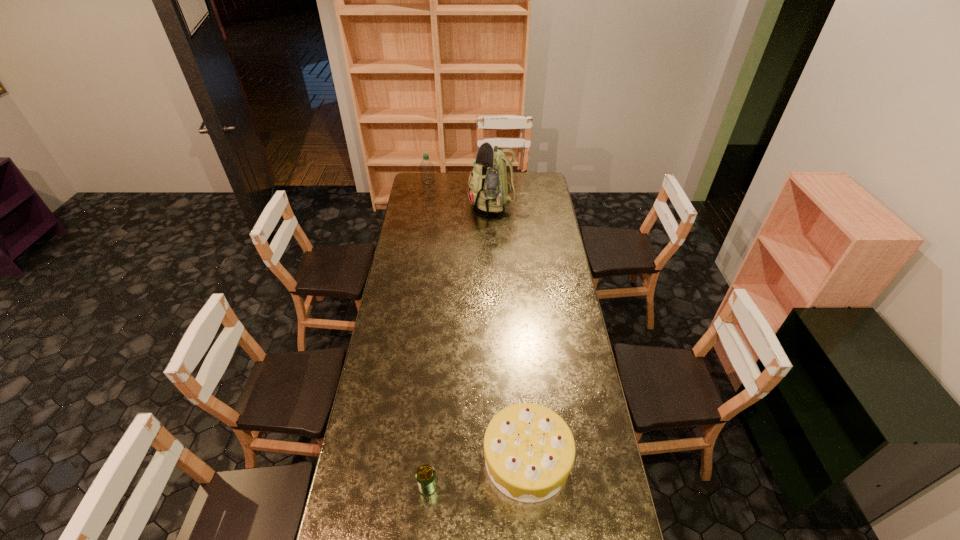
Find the location of a particular element. Image resolution: width=960 pixels, height=540 pixels. free space between the birthday cake and the shortest object is located at coordinates (477, 472).

This screenshot has width=960, height=540. In order to click on vacant area that lies between the beer can and the backpack in this screenshot , I will do `click(463, 346)`.

This screenshot has height=540, width=960. What are the coordinates of `vacant area between the birthday cake and the shortest object` in the screenshot? It's located at (477, 472).

Identify which object is located as the second nearest to the farthest object. Please provide its 2D coordinates. Your answer should be formatted as a tuple, i.e. [(x, y)], where the tuple contains the x and y coordinates of a point satisfying the conditions above.

[(529, 450)]

At what (x,y) coordinates should I click in order to perform the action: click on object that is the second closest to the backpack. Please return your answer as a coordinate pair (x, y). Image resolution: width=960 pixels, height=540 pixels. Looking at the image, I should click on (529, 450).

What are the coordinates of `free point that satisfies the following two spatial constraints: 1. on the front-facing side of the birthday cake; 2. on the left side of the second farthest object` in the screenshot? It's located at (512, 459).

This screenshot has height=540, width=960. Identify the location of vacant area that satisfies the following two spatial constraints: 1. on the back side of the birthday cake; 2. on the right side of the third object from right to left. (430, 459).